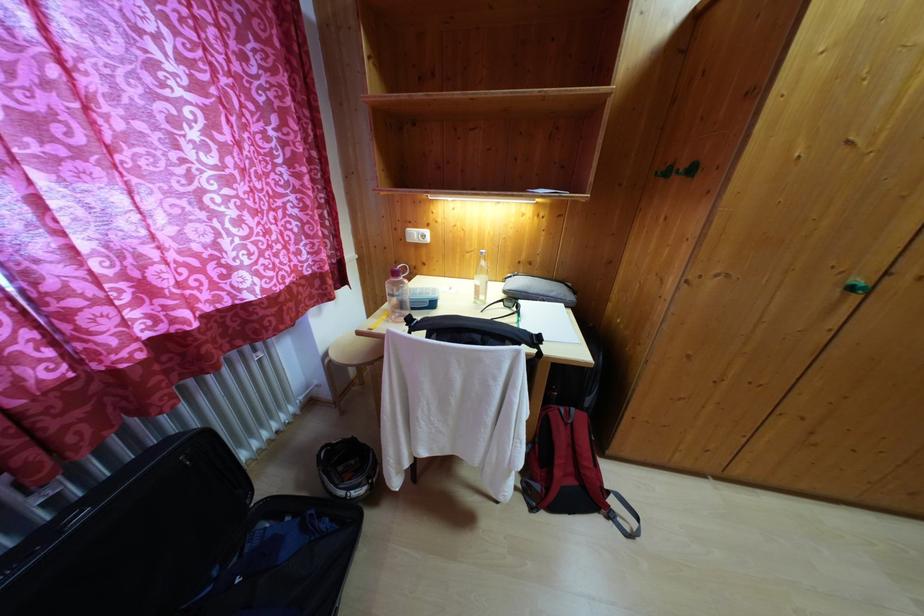
Identify the location of stool sitting surface. The image size is (924, 616). (355, 350).